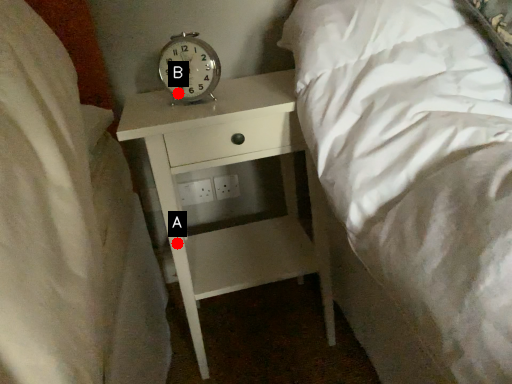
Question: Two points are circled on the image, labeled by A and B beside each circle. Among these points, which one is nearest to the camera?

Choices:
 (A) A is closer
 (B) B is closer

Answer: (B)